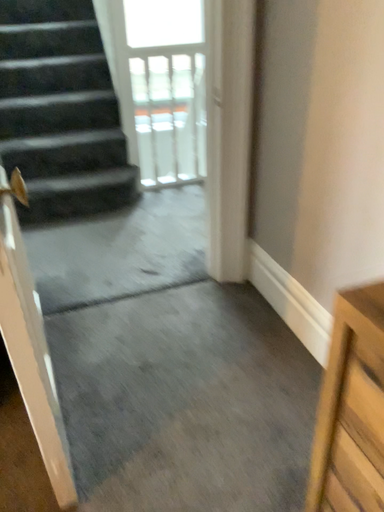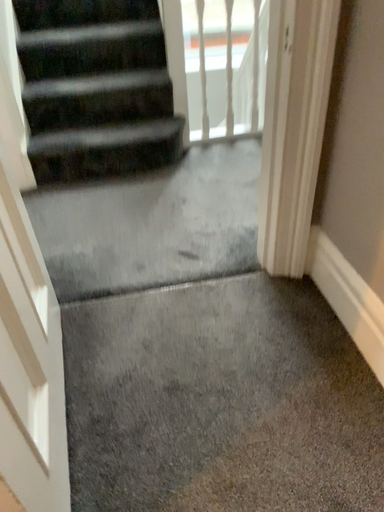
Question: How did the camera likely rotate when shooting the video?

Choices:
 (A) rotated left
 (B) rotated right

Answer: (A)